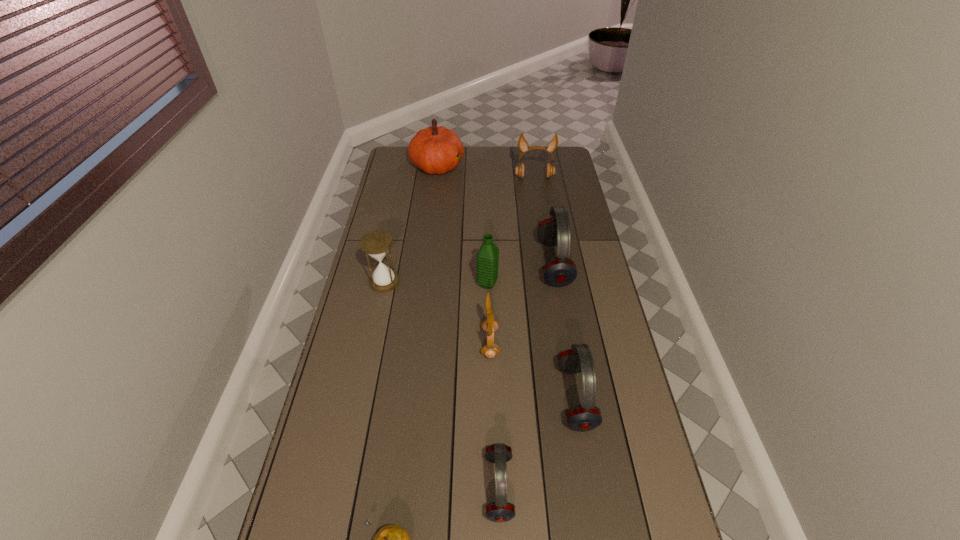
Where is `the nearer brown earphone`? The height and width of the screenshot is (540, 960). the nearer brown earphone is located at coordinates (489, 325).

This screenshot has height=540, width=960. In order to click on the leftmost red earphone in this screenshot , I will do `click(499, 511)`.

What are the coordinates of `the smallest red earphone` in the screenshot? It's located at (499, 511).

Locate an element on the screen. Image resolution: width=960 pixels, height=540 pixels. free space located 0.190m on the front-facing side of the pumpkin is located at coordinates (503, 165).

The image size is (960, 540). Identify the location of free space located on the ear cups of the fourth nearest earphone. (494, 264).

I want to click on vacant position located 0.080m on the ear cups of the fourth nearest earphone, so click(x=517, y=264).

The image size is (960, 540). Identify the location of vacant area situated on the ear cups of the fourth nearest earphone. (505, 264).

Identify the location of free space located 0.180m on the front-facing side of the right brown earphone. The width and height of the screenshot is (960, 540). (539, 204).

This screenshot has width=960, height=540. Identify the location of free point located on the left of the green water bottle. [452, 284].

Image resolution: width=960 pixels, height=540 pixels. Identify the location of free point located on the right of the white hourglass. (507, 282).